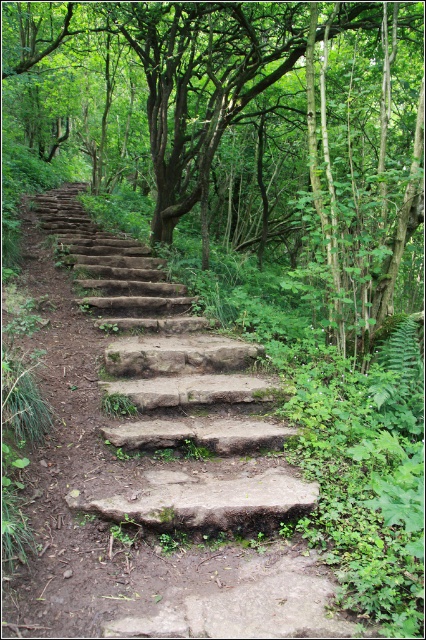
Question: Among these objects, which one is farthest from the camera?

Choices:
 (A) brown stone stairs at center
 (B) green leafy tree at center

Answer: (B)

Question: Which point is closer to the camera?

Choices:
 (A) (363, 193)
 (B) (253, 378)

Answer: (B)

Question: Considering the relative positions of green leafy tree at center and brown stone stairs at center in the image provided, where is green leafy tree at center located with respect to brown stone stairs at center?

Choices:
 (A) right
 (B) left

Answer: (B)

Question: Is green leafy tree at center smaller than brown stone stairs at center?

Choices:
 (A) yes
 (B) no

Answer: (B)

Question: Is green leafy tree at center thinner than brown stone stairs at center?

Choices:
 (A) no
 (B) yes

Answer: (A)

Question: Which object is closer to the camera taking this photo?

Choices:
 (A) brown stone stairs at center
 (B) green leafy tree at center

Answer: (A)